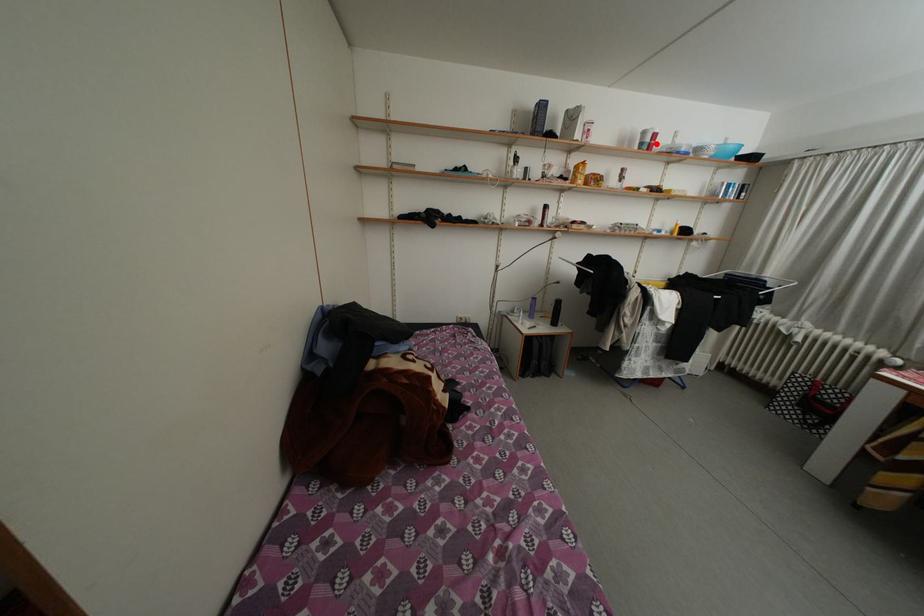
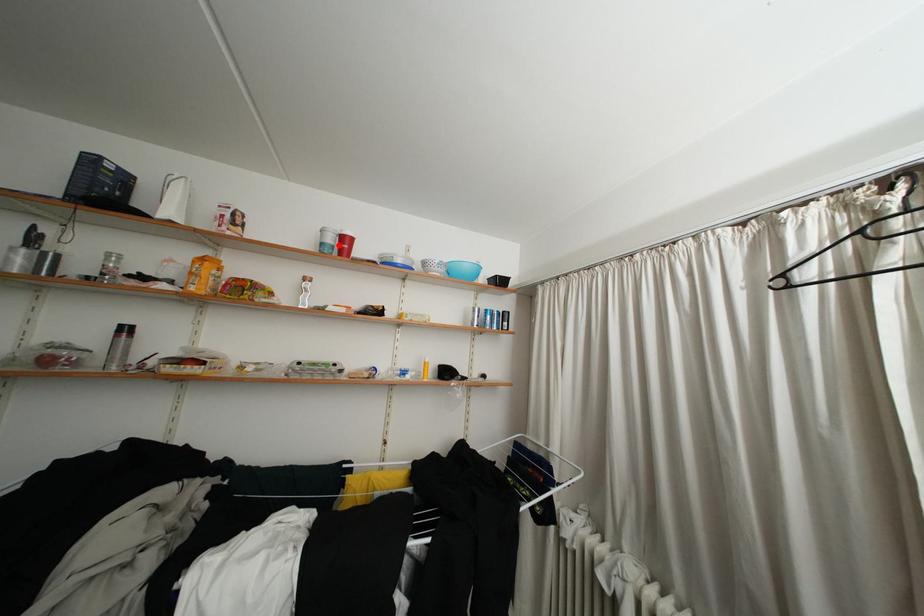
I am providing you with two images of the same scene from different viewpoints. A red point is marked on the first image and another point is marked on the second image. Are the points marked in image1 and image2 representing the same 3D position?

Yes